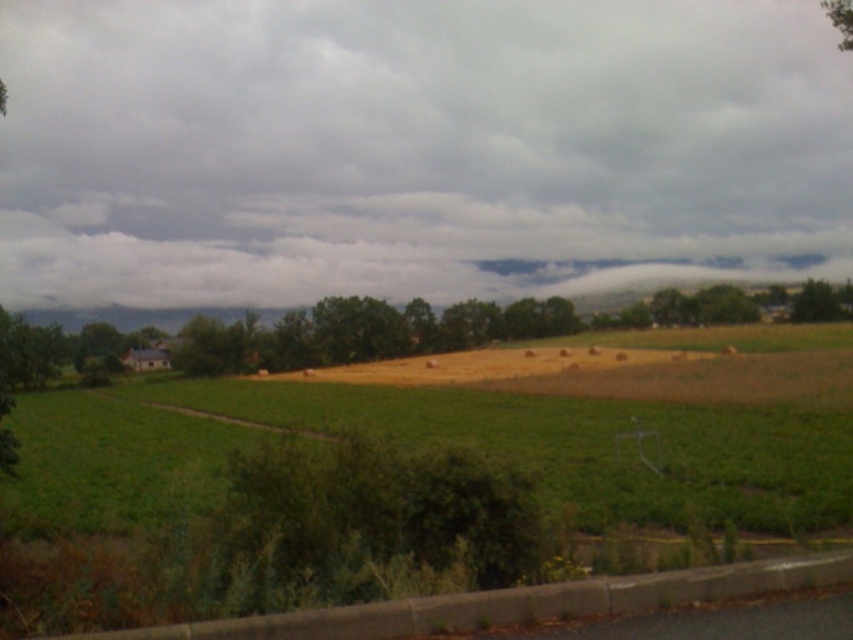
Question: Does cloudy sky at upper center appear on the left side of green leafy trees at center?

Choices:
 (A) yes
 (B) no

Answer: (B)

Question: Which object appears closest to the camera in this image?

Choices:
 (A) cloudy sky at upper center
 (B) green leafy trees at center

Answer: (B)

Question: Can you confirm if cloudy sky at upper center is smaller than green leafy trees at center?

Choices:
 (A) yes
 (B) no

Answer: (B)

Question: Which point appears closest to the camera in this image?

Choices:
 (A) (471, 310)
 (B) (260, 148)

Answer: (A)

Question: Is cloudy sky at upper center above green leafy trees at center?

Choices:
 (A) yes
 (B) no

Answer: (A)

Question: Among these points, which one is farthest from the camera?

Choices:
 (A) (532, 312)
 (B) (169, 212)

Answer: (B)